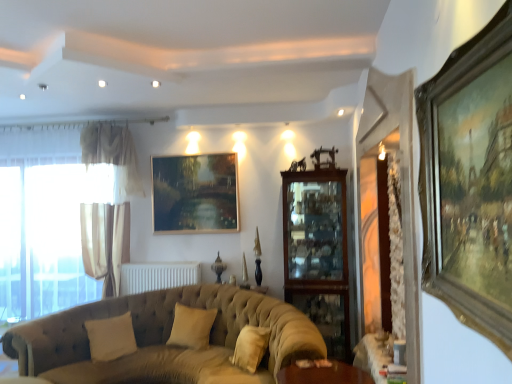
This screenshot has height=384, width=512. I want to click on free point above white matte radiator at center (from a real-world perspective), so click(x=159, y=262).